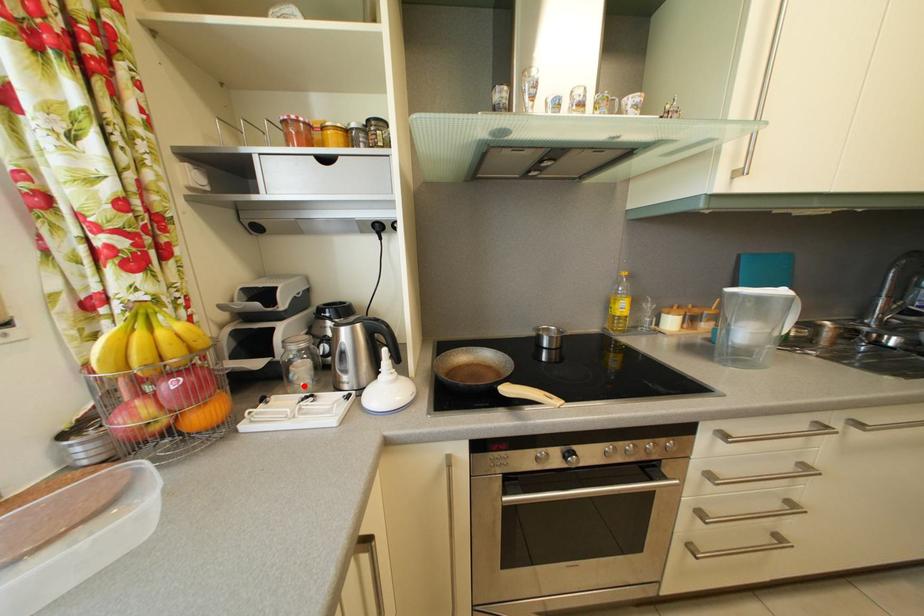
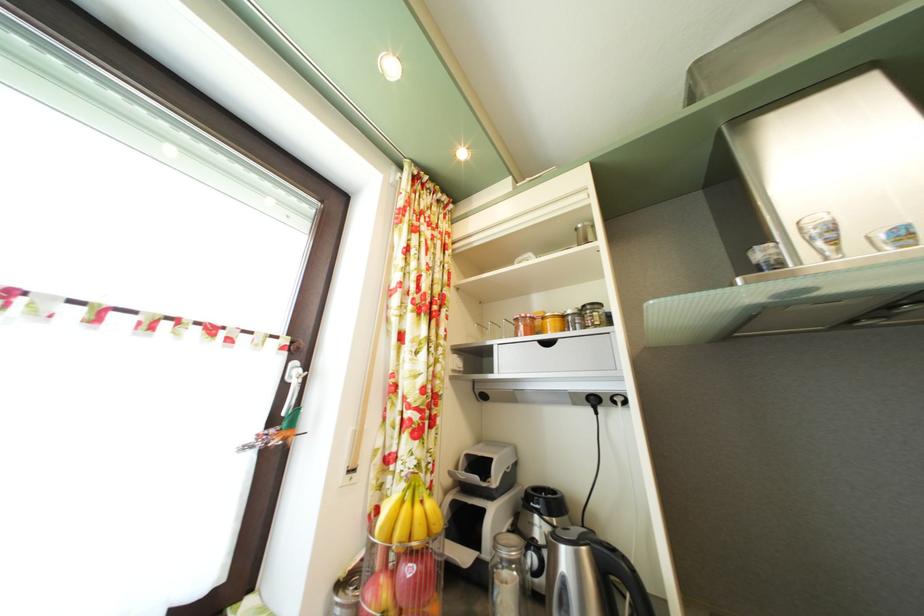
Where in the second image is the point corresponding to the highlighted location from the first image?

(506, 608)